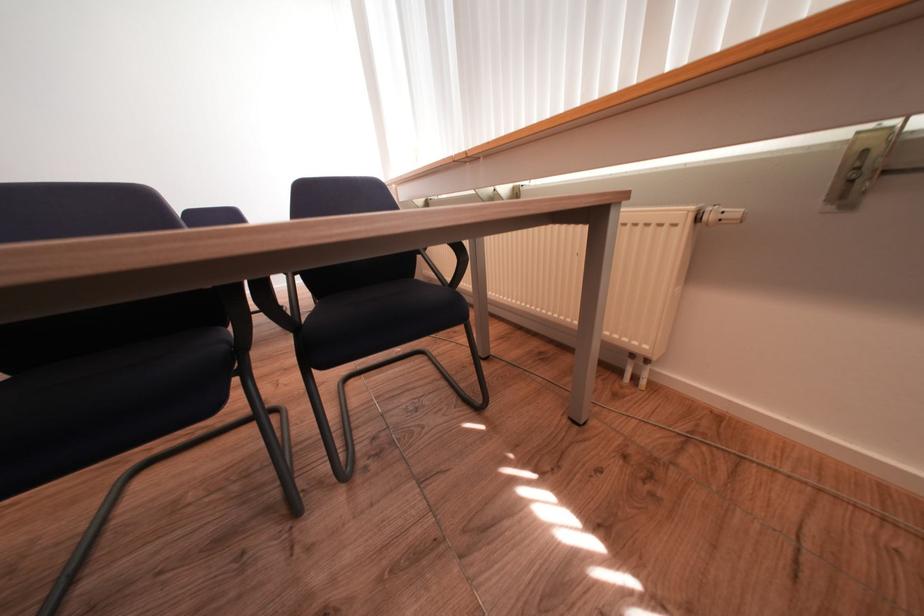
Where is `radiator valve knob`? This screenshot has height=616, width=924. radiator valve knob is located at coordinates tap(719, 215).